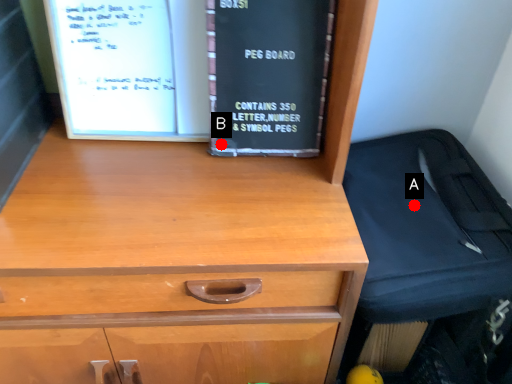
Question: Two points are circled on the image, labeled by A and B beside each circle. Which point is closer to the camera?

Choices:
 (A) A is closer
 (B) B is closer

Answer: (B)